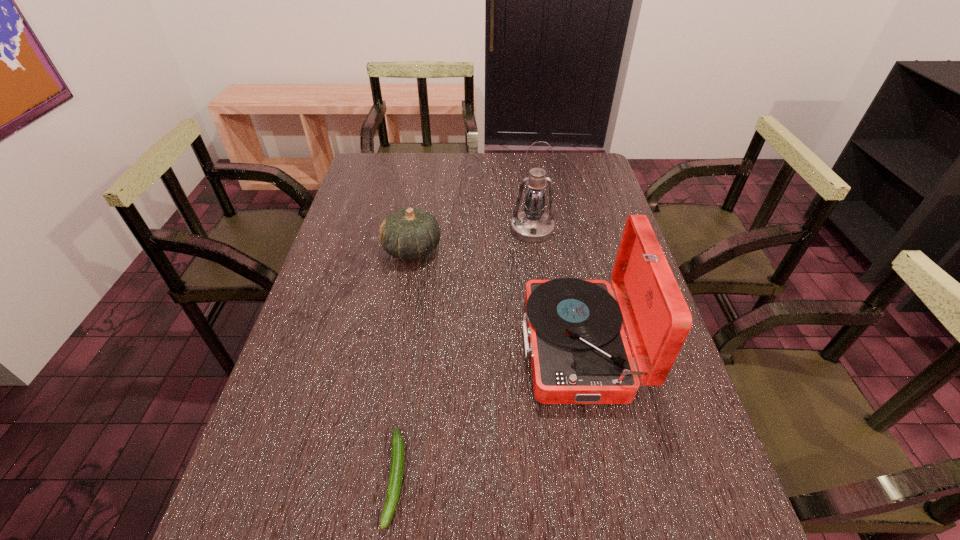
Where is `vacant area that lies between the zucchini and the third tallest object`? vacant area that lies between the zucchini and the third tallest object is located at coordinates (404, 363).

Locate an element on the screen. This screenshot has height=540, width=960. free spot between the nearest object and the oil lamp is located at coordinates (464, 354).

This screenshot has height=540, width=960. I want to click on free space between the shortest object and the third farthest object, so click(488, 412).

Where is `free point between the nearest object and the second nearest object`? The width and height of the screenshot is (960, 540). free point between the nearest object and the second nearest object is located at coordinates (488, 412).

Locate which object is the third closest to the nearest object. Please provide its 2D coordinates. Your answer should be formatted as a tuple, i.e. [(x, y)], where the tuple contains the x and y coordinates of a point satisfying the conditions above.

[(532, 225)]

Where is `object that can be found as the second closest to the phonograph_record`? object that can be found as the second closest to the phonograph_record is located at coordinates (409, 233).

The height and width of the screenshot is (540, 960). In order to click on free space in the image that satisfies the following two spatial constraints: 1. on the front-facing side of the third farthest object; 2. on the front-facing side of the nearest object in this screenshot , I will do `click(605, 478)`.

At what (x,y) coordinates should I click in order to perform the action: click on free spot that satisfies the following two spatial constraints: 1. on the back side of the oil lamp; 2. on the left side of the third tallest object. Please return your answer as a coordinate pair (x, y). This screenshot has width=960, height=540. Looking at the image, I should click on (416, 230).

The width and height of the screenshot is (960, 540). In order to click on free spot that satisfies the following two spatial constraints: 1. on the back side of the third tallest object; 2. on the left side of the oil lamp in this screenshot , I will do pyautogui.click(x=416, y=230).